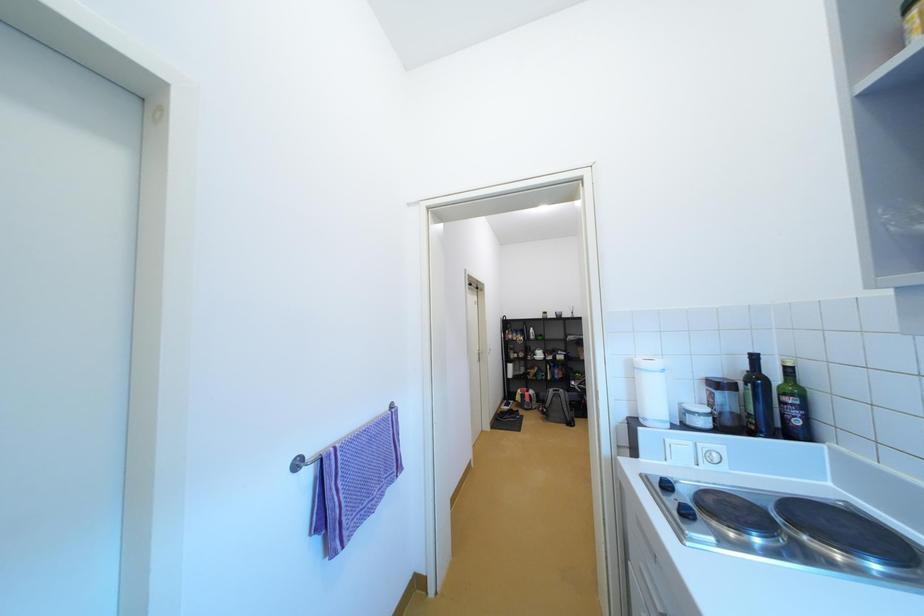
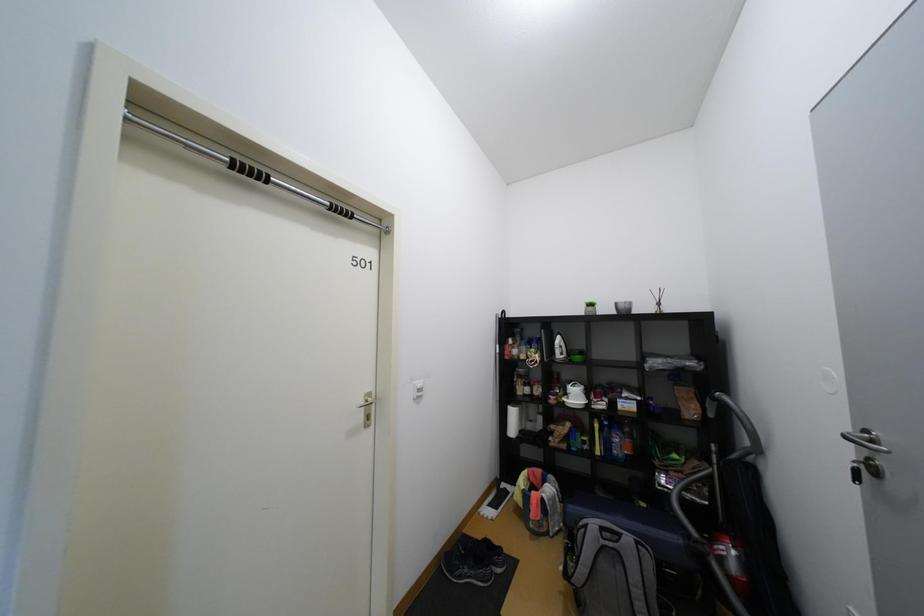
In the scene shown: The images are taken continuously from a first-person perspective. In which direction are you moving?

The cameraman walked toward right, forward.